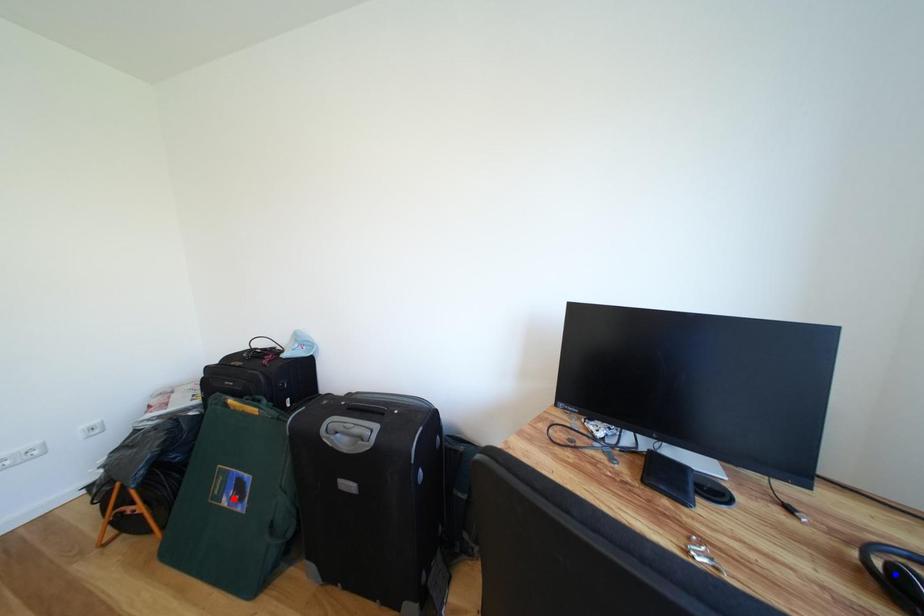
Question: Two points are marked on the image. Which point is closer to the camera?

Choices:
 (A) Blue point is closer.
 (B) Red point is closer.

Answer: (A)